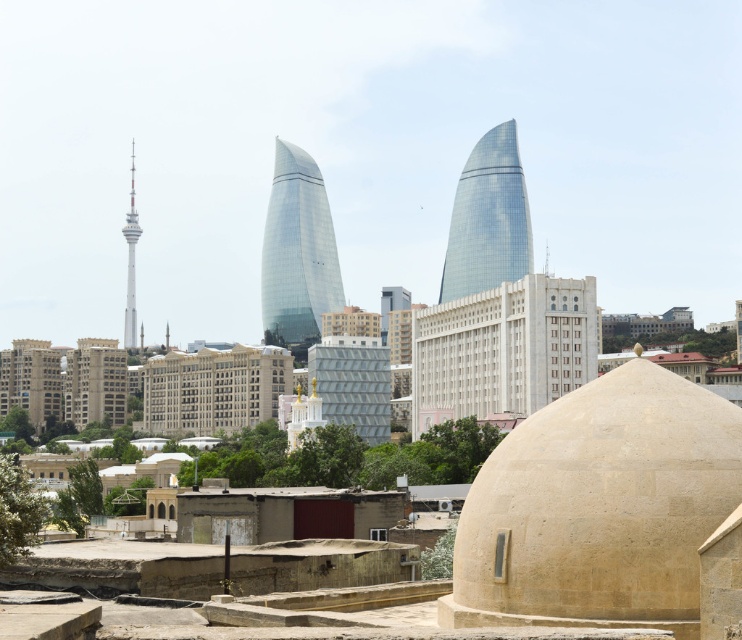
Question: Does beige stone dome at center appear on the left side of glassy blue tower at center?

Choices:
 (A) no
 (B) yes

Answer: (B)

Question: Estimate the real-world distances between objects in this image. Which object is farther from the transparent glass tower at center?

Choices:
 (A) glassy blue tower at center
 (B) metallic silver tower at left
 (C) beige stone dome at center

Answer: (C)

Question: Is transparent glass tower at center smaller than glassy blue tower at center?

Choices:
 (A) yes
 (B) no

Answer: (B)

Question: Is transparent glass tower at center wider than metallic silver tower at left?

Choices:
 (A) no
 (B) yes

Answer: (B)

Question: Among these objects, which one is farthest from the camera?

Choices:
 (A) metallic silver tower at left
 (B) glassy blue tower at center

Answer: (A)

Question: Which object appears farthest from the camera in this image?

Choices:
 (A) metallic silver tower at left
 (B) glassy blue tower at center
 (C) transparent glass tower at center

Answer: (A)